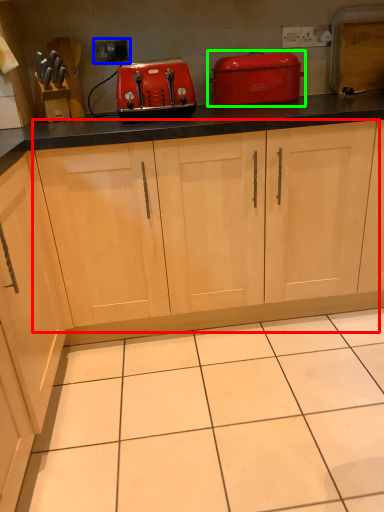
Question: Considering the real-world distances, which object is closest to cabinetry (highlighted by a red box)? electric outlet (highlighted by a blue box) or home appliance (highlighted by a green box).

Choices:
 (A) electric outlet
 (B) home appliance

Answer: (B)